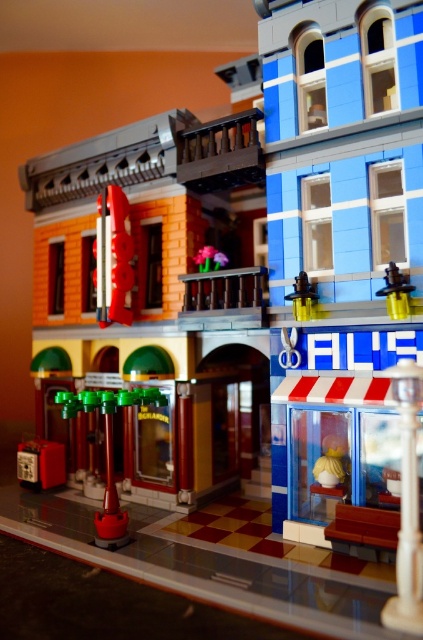
Is metallic silver pen at upper left taller than matte yellow vase at center?

Yes, metallic silver pen at upper left is taller than matte yellow vase at center.

Does metallic silver pen at upper left have a greater width compared to matte yellow vase at center?

Correct, the width of metallic silver pen at upper left exceeds that of matte yellow vase at center.

Is point (131, 269) behind point (318, 476)?

Yes, point (131, 269) is behind point (318, 476).

Locate an element on the screen. The height and width of the screenshot is (640, 423). metallic silver pen at upper left is located at coordinates (112, 257).

Looking at this image, which is below, green plastic street lamp at lower left or matte yellow vase at center?

matte yellow vase at center is lower down.

Is point (98, 408) farther from camera compared to point (324, 442)?

No, it is in front of (324, 442).

At what (x,y) coordinates should I click in order to perform the action: click on green plastic street lamp at lower left. Please return your answer as a coordinate pair (x, y). This screenshot has height=640, width=423. Looking at the image, I should click on (109, 451).

Which of these two, green plastic street lamp at lower left or yellow plastic toy at upper right, stands taller?

green plastic street lamp at lower left

Locate an element on the screen. This screenshot has width=423, height=640. green plastic street lamp at lower left is located at coordinates (109, 451).

Is point (145, 397) positioned before point (401, 284)?

No, (145, 397) is behind (401, 284).

The image size is (423, 640). I want to click on green plastic street lamp at lower left, so click(109, 451).